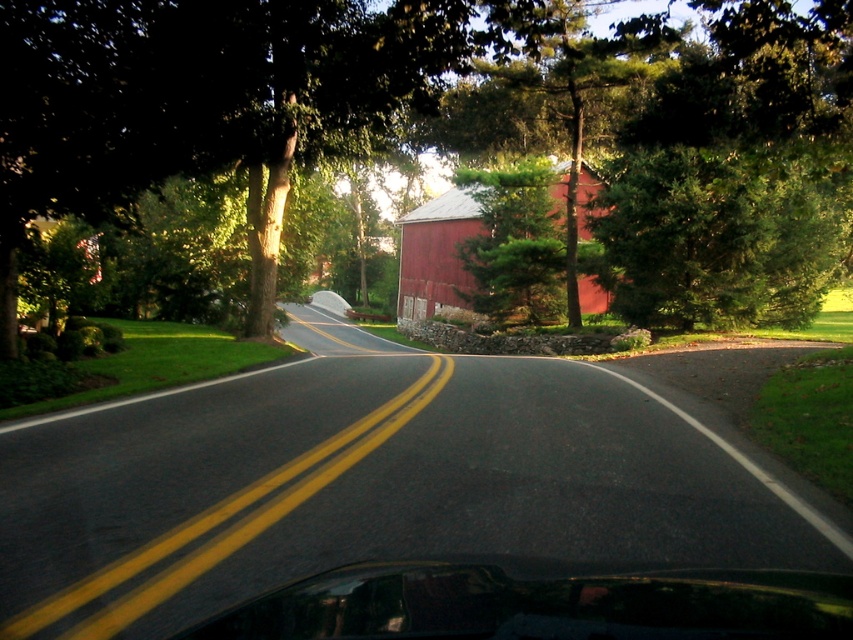
Question: Is green leafy tree at upper center bigger than smooth red barn at center?

Choices:
 (A) yes
 (B) no

Answer: (B)

Question: Which point is farther to the camera?

Choices:
 (A) green leafy tree at upper center
 (B) smooth red barn at center

Answer: (B)

Question: Which of the following is the farthest from the observer?

Choices:
 (A) (407, 276)
 (B) (418, 35)

Answer: (A)

Question: Observing the image, what is the correct spatial positioning of green leafy tree at upper center in reference to smooth red barn at center?

Choices:
 (A) below
 (B) above

Answer: (A)

Question: Does green leafy tree at upper center have a smaller size compared to smooth red barn at center?

Choices:
 (A) yes
 (B) no

Answer: (A)